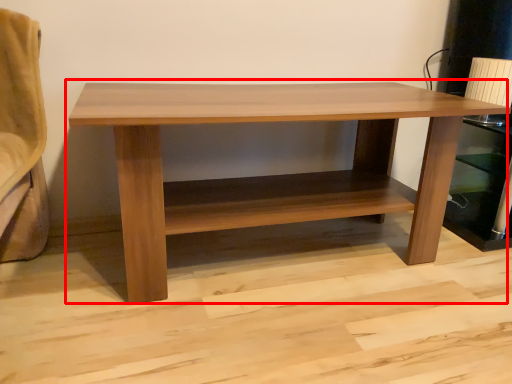
Question: From the image's perspective, where is table (annotated by the red box) located in relation to shelf in the image?

Choices:
 (A) below
 (B) above

Answer: (A)